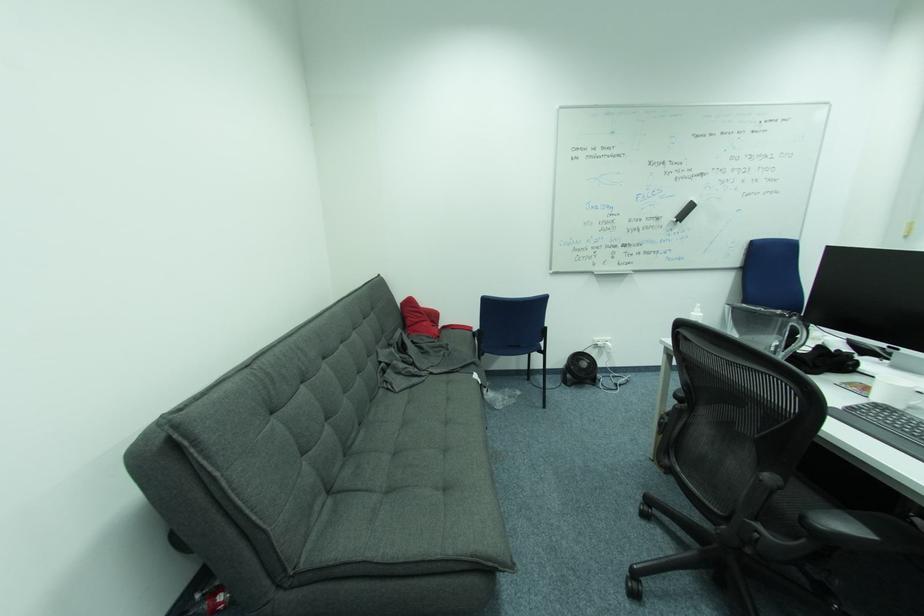
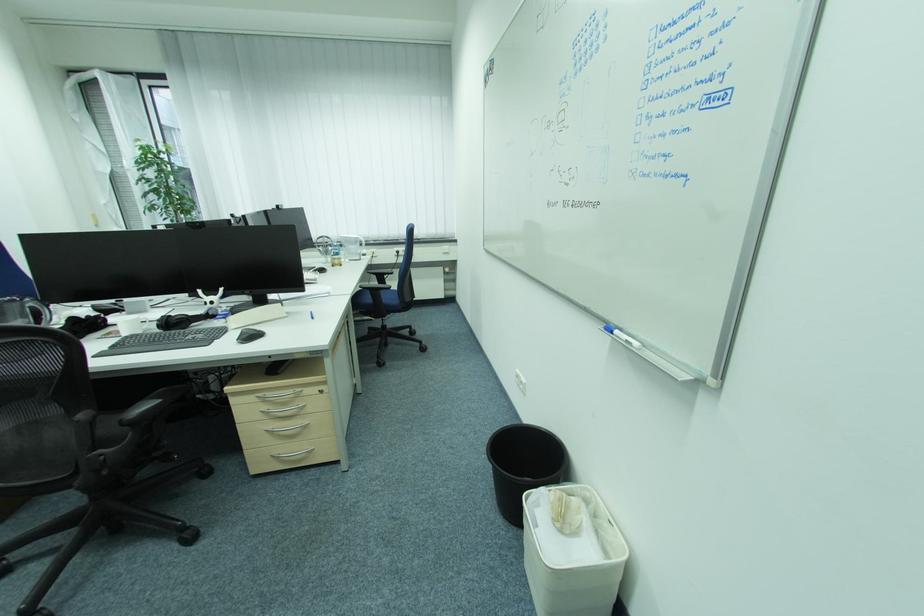
In the scene shown: Based on the continuous images, in which direction is the camera rotating?

The rotation direction of the camera is right-down.